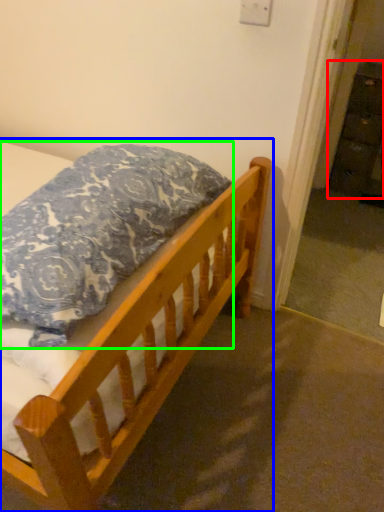
Question: Which is farther away from dresser (highlighted by a red box)? bed (highlighted by a blue box) or pillow (highlighted by a green box)?

Choices:
 (A) bed
 (B) pillow

Answer: (B)